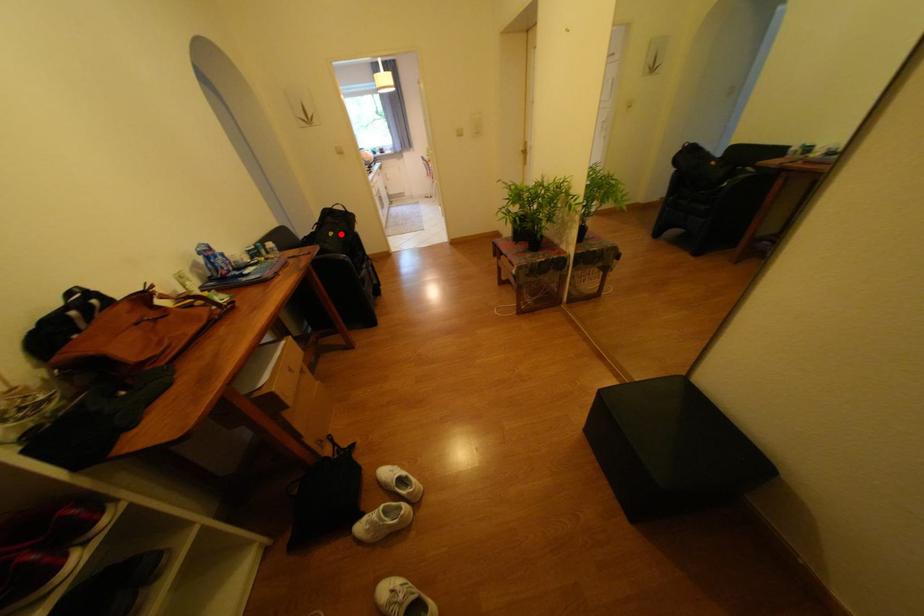
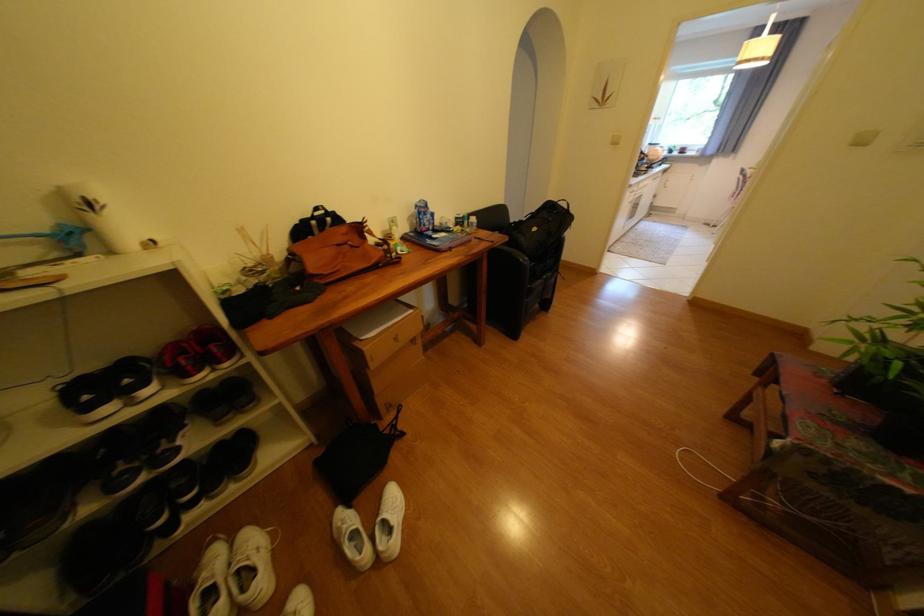
Question: I am providing you with two images of the same scene from different viewpoints. Given a red point in image1, look at the same physical point in image2. Is it:

Choices:
 (A) Closer to the viewpoint
 (B) Farther from the viewpoint

Answer: (B)